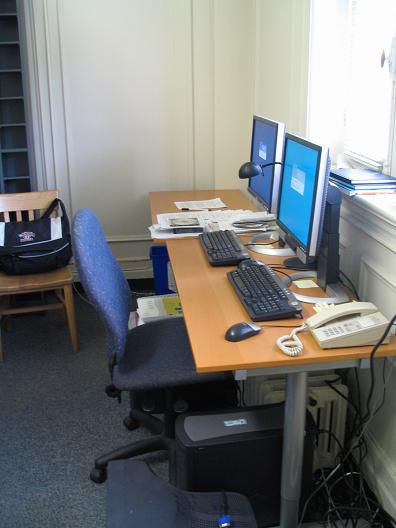
Where is `wooden chair`? The width and height of the screenshot is (396, 528). wooden chair is located at coordinates (26, 280).